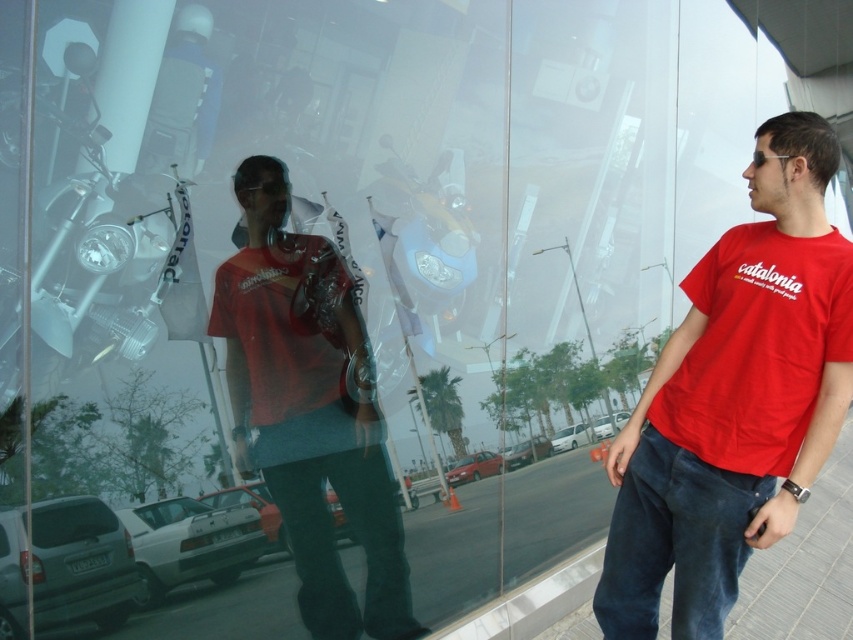
You are standing at the entrance of the store and want to place a small potted plant exactly where the gray concrete pavement at lower center is located. According to the scene description, where should you place the potted plant?

The gray concrete pavement at lower center is located at point (805, 564), so you should place the potted plant at that coordinate.